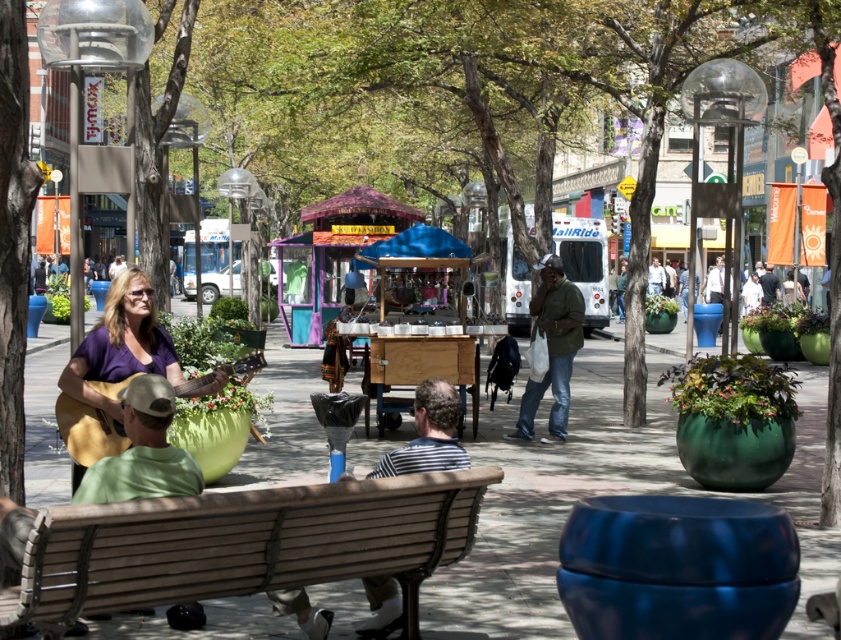
Where is the green fabric hat at center located in the image?

The green fabric hat at center is located at point (141,451) in the image.

You are a person who wants to place a small plant pot between the green matte jacket at center and the denim jacket at center. Which jacket should you place it closer to if you want the pot to be closer to the shorter one?

The green matte jacket at center is shorter than the denim jacket at center, so placing the small plant pot closer to the green matte jacket at center would position it near the shorter one.

You are a photographer trying to capture a candid shot of both the green fabric hat at center and the green matte jacket at center. Since you want to ensure both are visible in the frame, which object should you position closer to the edge of your camera viewfinder to avoid cropping?

You should position the green fabric hat at center closer to the edge of your camera viewfinder because it is on the left side of the green matte jacket at center, so moving it towards the edge ensures both remain in frame without cropping.